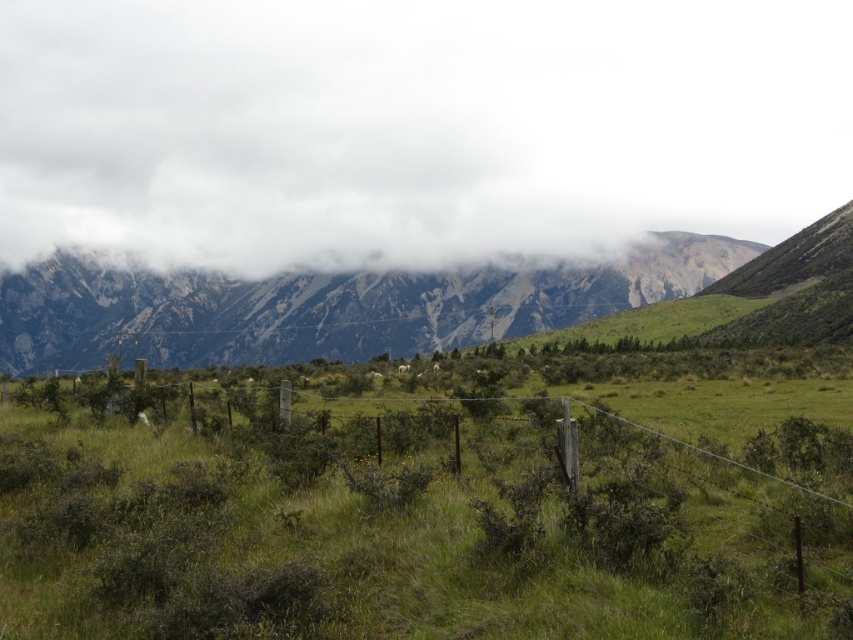
Question: Which object is positioned closest to the white fluffy cloud at upper center?

Choices:
 (A) green grassy at center
 (B) rugged stone mountain range at center

Answer: (B)

Question: Which point is farther from the camera taking this photo?

Choices:
 (A) (7, 289)
 (B) (117, 52)

Answer: (B)

Question: Considering the relative positions of white fluffy cloud at upper center and green grassy at center in the image provided, where is white fluffy cloud at upper center located with respect to green grassy at center?

Choices:
 (A) below
 (B) above

Answer: (B)

Question: Estimate the real-world distances between objects in this image. Which object is farther from the green grassy at center?

Choices:
 (A) rugged stone mountain range at center
 (B) white fluffy cloud at upper center

Answer: (B)

Question: Can you confirm if white fluffy cloud at upper center is positioned to the right of green grassy at center?

Choices:
 (A) no
 (B) yes

Answer: (A)

Question: Does green grassy at center have a larger size compared to rugged stone mountain range at center?

Choices:
 (A) yes
 (B) no

Answer: (B)